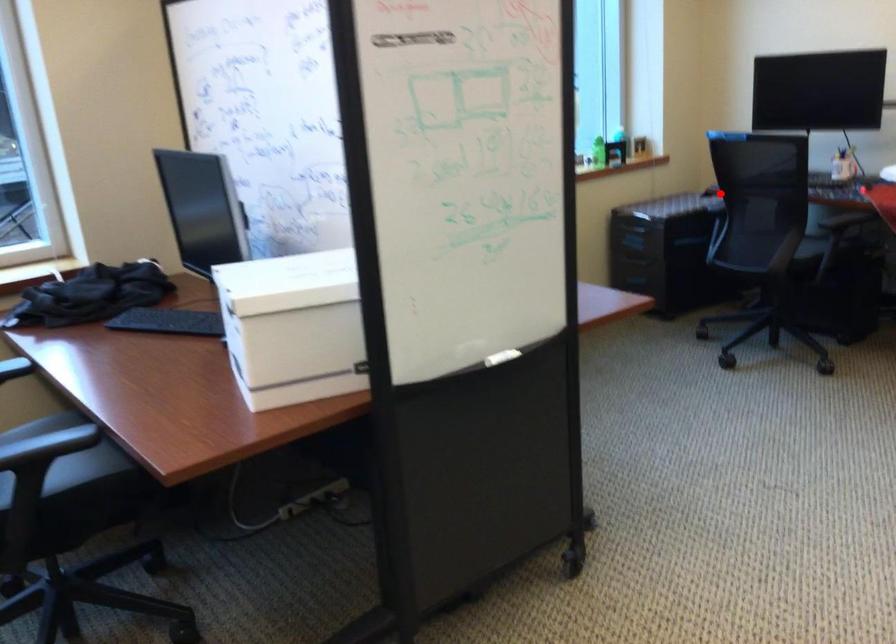
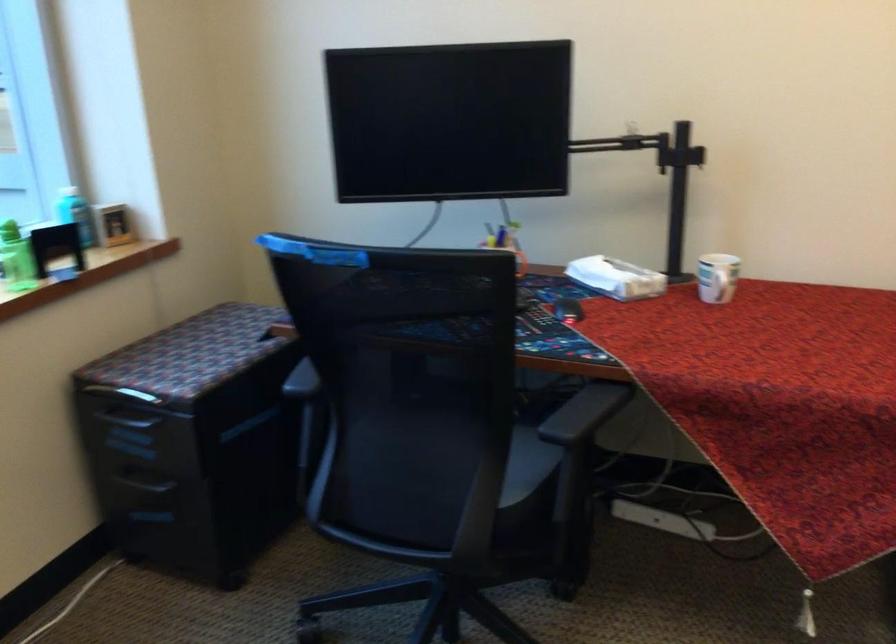
In the second image, find the point that corresponds to the highlighted location in the first image.

(302, 380)